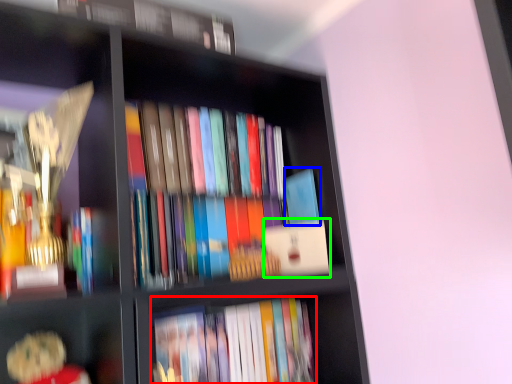
Question: Estimate the real-world distances between objects in this image. Which object is farther from book (highlighted by a red box), paperback book (highlighted by a blue box) or paperback book (highlighted by a green box)?

Choices:
 (A) paperback book
 (B) paperback book

Answer: (A)